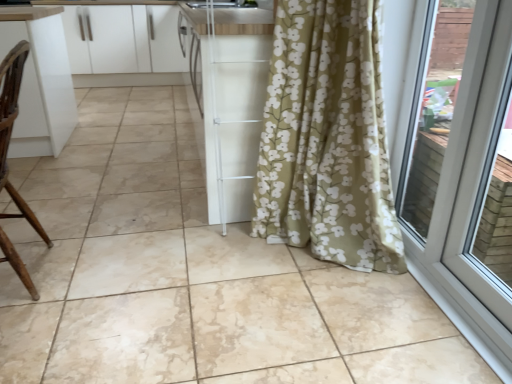
Question: Should I look upward or downward to see white plastic door at right?

Choices:
 (A) up
 (B) down

Answer: (A)

Question: From the image's perspective, does white plastic door at right appear higher than brown wood chair at left?

Choices:
 (A) yes
 (B) no

Answer: (B)

Question: Is white plastic door at right aimed at brown wood chair at left?

Choices:
 (A) yes
 (B) no

Answer: (A)

Question: Is white plastic door at right at the left side of brown wood chair at left?

Choices:
 (A) yes
 (B) no

Answer: (B)

Question: Is brown wood chair at left at the back of white plastic door at right?

Choices:
 (A) no
 (B) yes

Answer: (A)

Question: Is white plastic door at right located outside brown wood chair at left?

Choices:
 (A) yes
 (B) no

Answer: (A)

Question: From a real-world perspective, is white plastic door at right physically below brown wood chair at left?

Choices:
 (A) yes
 (B) no

Answer: (B)

Question: From the image's perspective, does brown wood chair at left appear higher than white glossy cabinets at upper left?

Choices:
 (A) yes
 (B) no

Answer: (B)

Question: From a real-world perspective, is brown wood chair at left located higher than white glossy cabinets at upper left?

Choices:
 (A) no
 (B) yes

Answer: (B)

Question: Is brown wood chair at left behind white glossy cabinets at upper left?

Choices:
 (A) no
 (B) yes

Answer: (A)

Question: Can you confirm if brown wood chair at left is positioned to the right of white glossy cabinets at upper left?

Choices:
 (A) no
 (B) yes

Answer: (B)

Question: Can you confirm if brown wood chair at left is thinner than white glossy cabinets at upper left?

Choices:
 (A) yes
 (B) no

Answer: (A)

Question: Could you tell me if brown wood chair at left is facing white glossy cabinets at upper left?

Choices:
 (A) yes
 (B) no

Answer: (B)

Question: Is brown wood chair at left positioned with its back to white plastic door at right?

Choices:
 (A) yes
 (B) no

Answer: (A)